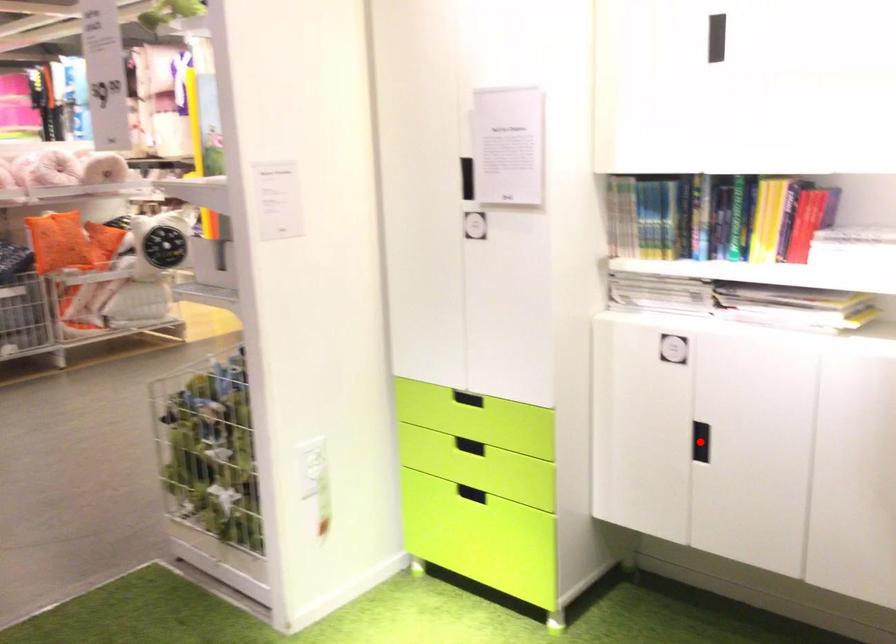
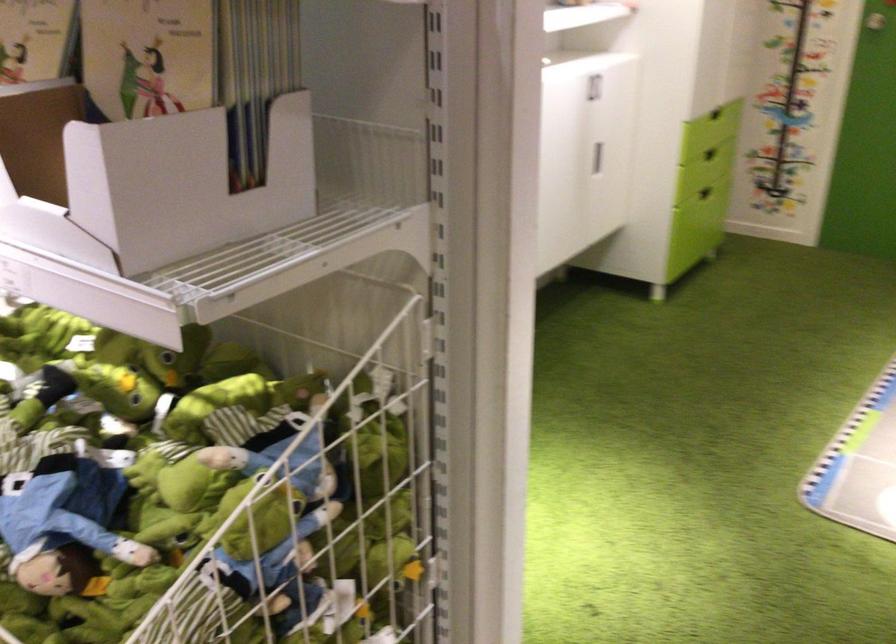
Question: I am providing you with two images of the same scene from different viewpoints. A red point is marked on the first image. Is the red point's position out of view in image 2?

Choices:
 (A) Yes
 (B) No

Answer: (A)